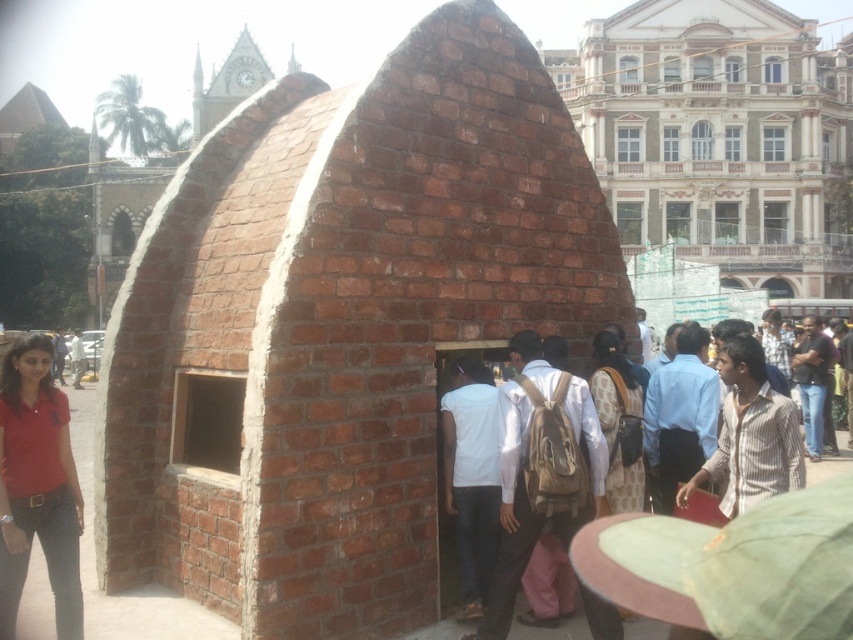
Who is lower down, brown backpack at center or matte red polo shirt at lower left?

Positioned lower is brown backpack at center.

Is brown backpack at center bigger than matte red polo shirt at lower left?

Yes.

Between point (733, 547) and point (13, 358), which one is positioned in front?

Point (733, 547) is in front.

You are a GUI agent. You are given a task and a screenshot of the screen. Output one action in this format:
    pyautogui.click(x=<x>, y=<y>)
    Task: Click on the brown backpack at center
    This screenshot has height=640, width=853.
    Given the screenshot: What is the action you would take?
    tap(732, 566)